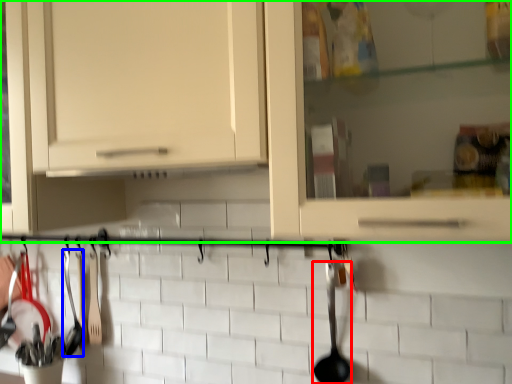
Question: Considering the real-world distances, which object is farthest from silverware (highlighted by a red box)? silverware (highlighted by a blue box) or cabinetry (highlighted by a green box)?

Choices:
 (A) silverware
 (B) cabinetry

Answer: (A)